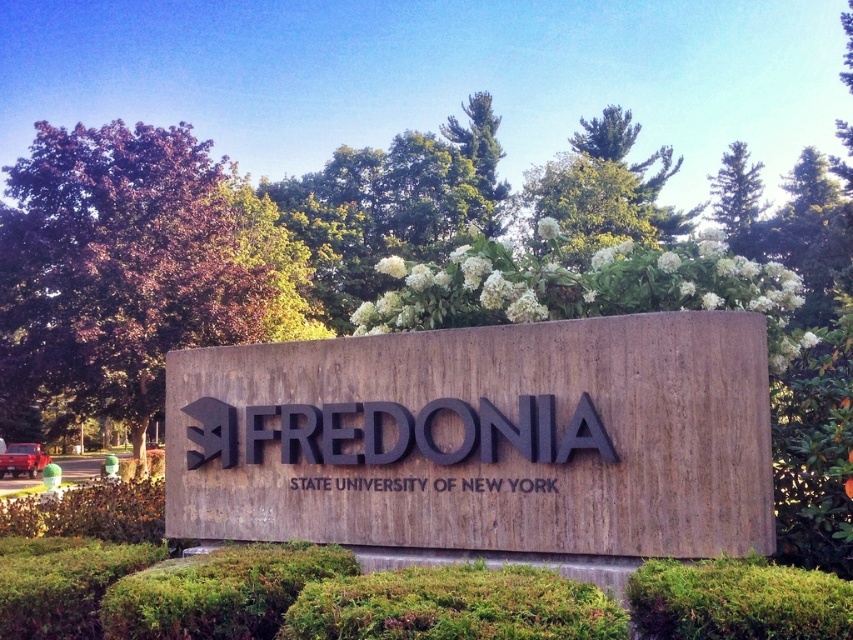
You are a landscape architect designing a garden layout. You need to place the black concrete sign at center and the black matte sign at center in such a way that they are both visible from the main pathway. Given their height difference, which sign will be more visible from a distance?

The black concrete sign at center will be more visible from a distance because it has a greater height compared to the black matte sign at center.

You are a landscape architect designing a pathway leading to the black concrete sign at center and the black matte sign at center. Since both signs are at the center, how can you determine which sign to place closer to the pathway entrance?

The black concrete sign at center is bigger than the black matte sign at center, so the larger black concrete sign at center should be placed closer to the pathway entrance to ensure visibility.

You are a landscape architect designing a pathway around the black concrete sign at center and the black matte sign at center. Given that the minimum required distance between two signs for accessibility is 10 inches, will the current spacing between these two signs meet the requirement?

The black concrete sign at center is 9.11 inches from black matte sign at center. Since the required minimum distance is 10 inches, the current spacing does not meet the accessibility requirement.